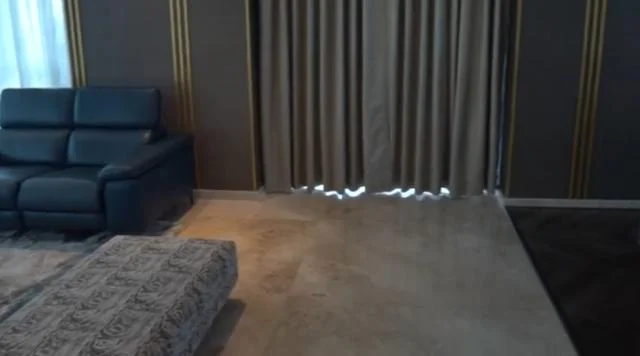
What are the coordinates of `empty wall to the right` in the screenshot? It's located at (545, 81).